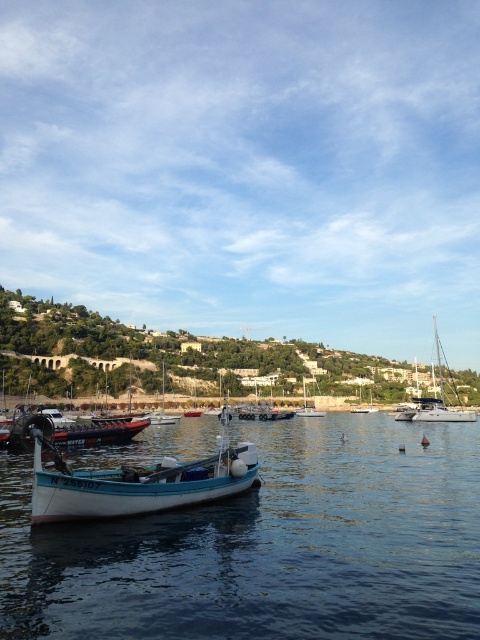
Question: Considering the real-world distances, which object is closest to the brushed metal boat at center?

Choices:
 (A) white smooth water at center
 (B) white glossy sailboat at center

Answer: (A)

Question: Does brushed metal boat at center have a greater width compared to white matte sailboat at center?

Choices:
 (A) yes
 (B) no

Answer: (A)

Question: Considering the real-world distances, which object is closest to the blue wooden boat at center?

Choices:
 (A) light blue wooden boat at center
 (B) white glossy sailboat at center

Answer: (B)

Question: Does white smooth water at center have a larger size compared to light blue wooden boat at center?

Choices:
 (A) no
 (B) yes

Answer: (A)

Question: In this image, where is light blue wooden boat at center located relative to white glossy sailboat at center?

Choices:
 (A) below
 (B) above

Answer: (B)

Question: Considering the real-world distances, which object is closest to the white matte sailboat at center?

Choices:
 (A) blue wooden boat at center
 (B) light blue wooden boat at center
 (C) white smooth water at center
 (D) white glossy sailboat at center

Answer: (D)